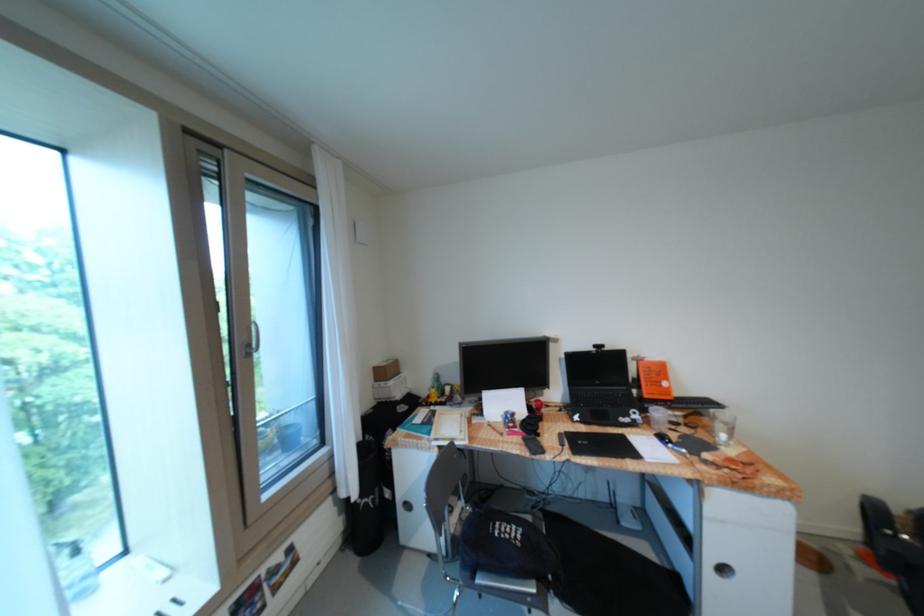
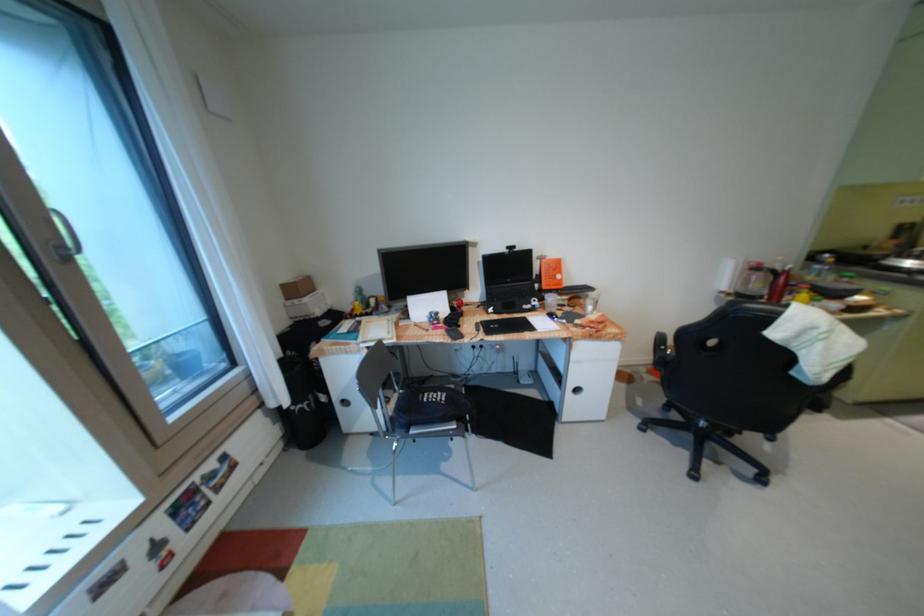
Where in the second image is the point corresponding to the point at 871,549 from the first image?

(661, 368)